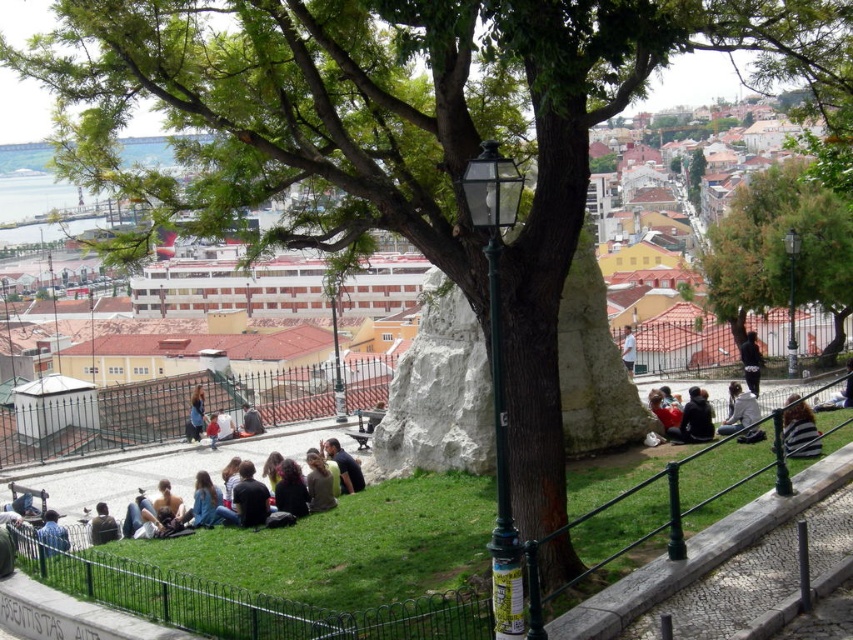
You are looking at the scene and notice two people sitting on the grass. One is wearing a dark blue sweater at center and the other a white cotton shirt at center. From your perspective, which clothing item is positioned more to the left?

The dark blue sweater at center is positioned more to the left than the white cotton shirt at center.

You are standing at the center of the image and want to pick up the dark brown leather jacket at lower center. Which direction should you move to reach it?

You should move downward because the dark brown leather jacket at lower center is located at point (161, 513), which is in the lower part of the image.

You are a photographer trying to capture a photo of the blue denim jeans at center and the striped fabric at lower right. To ensure both are in frame, should you adjust your camera to the left or right?

You should adjust your camera to the left because the striped fabric at lower right is to the right of the blue denim jeans at center, so moving left will keep both in frame.